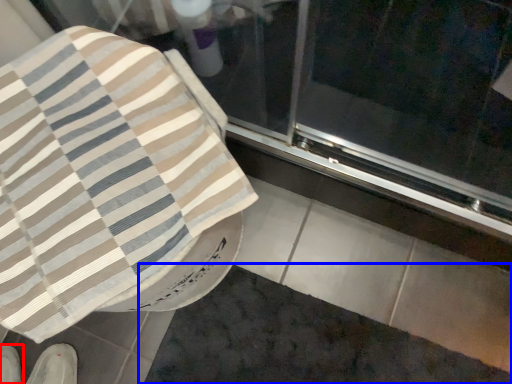
Question: Which object appears closest to the camera in this image, footwear (highlighted by a red box) or bath mat (highlighted by a blue box)?

Choices:
 (A) footwear
 (B) bath mat

Answer: (B)